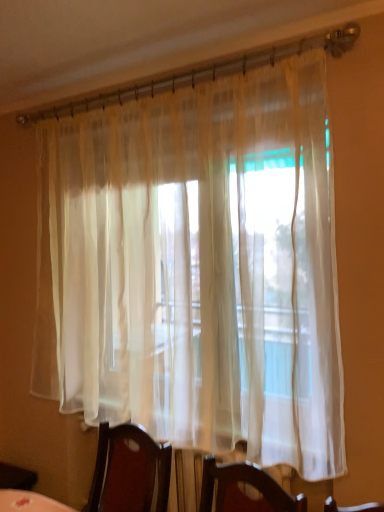
Question: Should I look upward or downward to see translucent white curtain at center?

Choices:
 (A) up
 (B) down

Answer: (B)